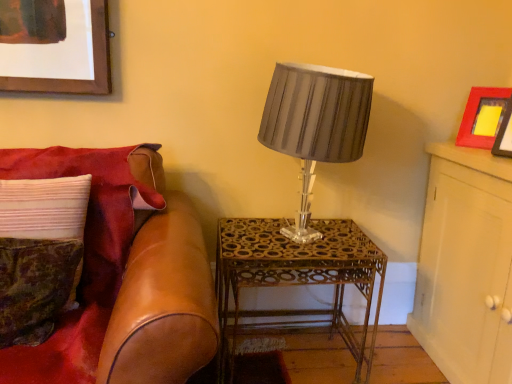
Question: Would you say matte gray fabric lampshade at center is a long distance from white wood cabinet at upper right?

Choices:
 (A) no
 (B) yes

Answer: (A)

Question: Is matte gray fabric lampshade at center oriented away from white wood cabinet at upper right?

Choices:
 (A) yes
 (B) no

Answer: (B)

Question: From the image's perspective, is matte gray fabric lampshade at center over white wood cabinet at upper right?

Choices:
 (A) yes
 (B) no

Answer: (A)

Question: Is matte gray fabric lampshade at center aimed at white wood cabinet at upper right?

Choices:
 (A) yes
 (B) no

Answer: (B)

Question: Is matte gray fabric lampshade at center positioned beyond the bounds of white wood cabinet at upper right?

Choices:
 (A) yes
 (B) no

Answer: (A)

Question: From the image's perspective, does matte gray fabric lampshade at center appear lower than white wood cabinet at upper right?

Choices:
 (A) no
 (B) yes

Answer: (A)

Question: From a real-world perspective, is white wood cabinet at upper right below matte red picture frame at upper right?

Choices:
 (A) no
 (B) yes

Answer: (B)

Question: Is white wood cabinet at upper right taller than matte red picture frame at upper right?

Choices:
 (A) yes
 (B) no

Answer: (A)

Question: Is white wood cabinet at upper right far away from matte red picture frame at upper right?

Choices:
 (A) no
 (B) yes

Answer: (A)

Question: Is white wood cabinet at upper right positioned in front of matte red picture frame at upper right?

Choices:
 (A) yes
 (B) no

Answer: (A)

Question: Is white wood cabinet at upper right bigger than matte red picture frame at upper right?

Choices:
 (A) yes
 (B) no

Answer: (A)

Question: Can you confirm if white wood cabinet at upper right is positioned to the right of matte red picture frame at upper right?

Choices:
 (A) no
 (B) yes

Answer: (B)

Question: Does gold metallic table at center have a greater height compared to matte red picture frame at upper right?

Choices:
 (A) no
 (B) yes

Answer: (B)